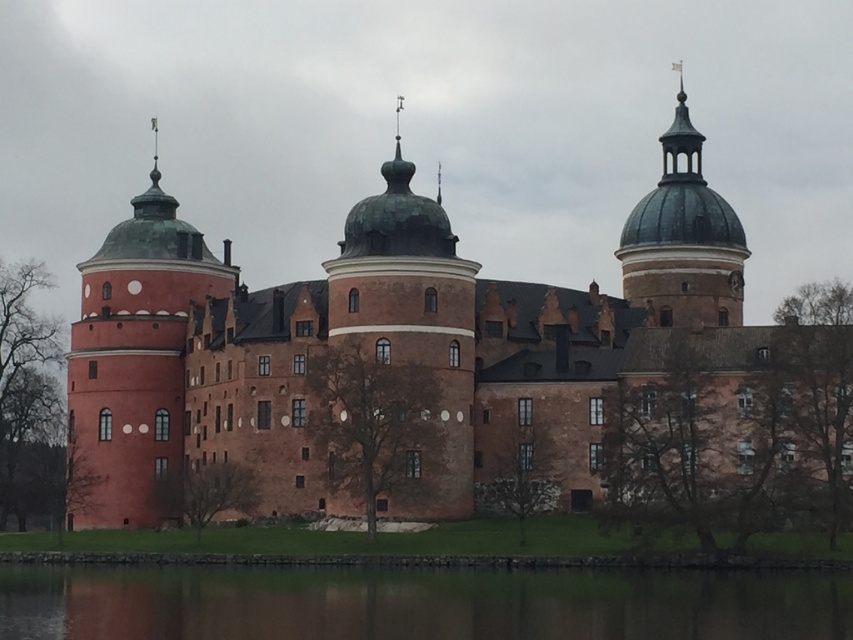
Question: Which object is closer to the camera taking this photo?

Choices:
 (A) rustic brick castle at center
 (B) green copper dome at upper right
 (C) green reflective water at lower center
 (D) matte copper tower at left

Answer: (C)

Question: Is matte copper tower at left wider than green copper dome at upper right?

Choices:
 (A) no
 (B) yes

Answer: (B)

Question: Can you confirm if green reflective water at lower center is positioned above green copper dome at upper right?

Choices:
 (A) no
 (B) yes

Answer: (A)

Question: Which object is the farthest from the green copper dome at upper right?

Choices:
 (A) matte copper tower at left
 (B) rustic brick castle at center
 (C) green reflective water at lower center

Answer: (C)

Question: Which point is closer to the camera?

Choices:
 (A) matte copper tower at left
 (B) green copper dome at upper right
 (C) green reflective water at lower center

Answer: (C)

Question: Is matte copper tower at left wider than green copper dome at upper right?

Choices:
 (A) yes
 (B) no

Answer: (A)